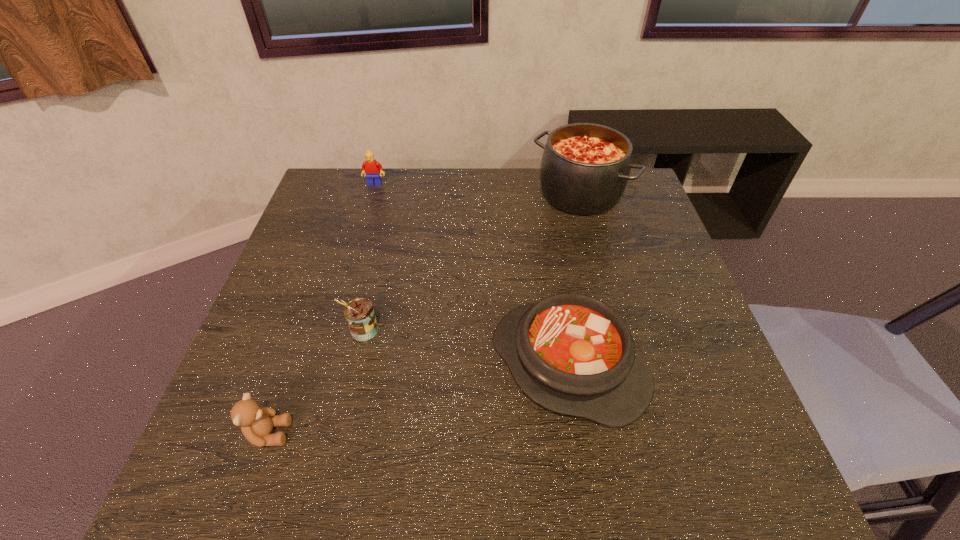
Identify the location of vacant space located 0.400m on the face of the teddy bear. [x=504, y=433].

Identify the location of casserole situated at the far edge. This screenshot has width=960, height=540. (585, 167).

Identify the location of Lego located in the far edge section of the desktop. The image size is (960, 540). (371, 168).

Locate an element on the screen. This screenshot has width=960, height=540. object located at the near edge is located at coordinates (256, 422).

Where is `Lego at the left edge`? Lego at the left edge is located at coordinates (371, 168).

In order to click on teddy bear positioned at the left edge in this screenshot , I will do `click(256, 422)`.

At what (x,y) coordinates should I click in order to perform the action: click on object present at the far left corner. Please return your answer as a coordinate pair (x, y). Image resolution: width=960 pixels, height=540 pixels. Looking at the image, I should click on (371, 168).

At what (x,y) coordinates should I click in order to perform the action: click on object located at the near left corner. Please return your answer as a coordinate pair (x, y). The image size is (960, 540). Looking at the image, I should click on (256, 422).

The height and width of the screenshot is (540, 960). In order to click on object at the far right corner in this screenshot , I will do `click(585, 167)`.

At what (x,y) coordinates should I click in order to perform the action: click on vacant space at the far edge. Please return your answer as a coordinate pair (x, y). Looking at the image, I should click on (434, 175).